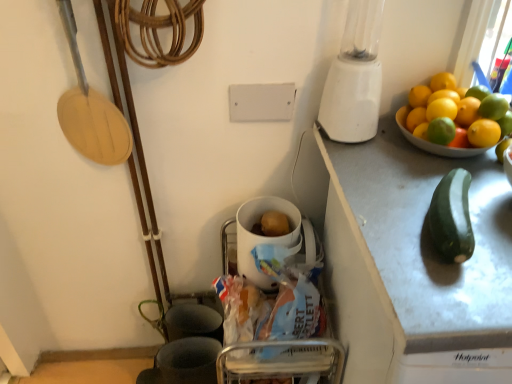
You are a GUI agent. You are given a task and a screenshot of the screen. Output one action in this format:
    pyautogui.click(x=<x>, y=<y>)
    Task: Click on the vacant space to the left of green matte lemon at upper right, which appears as the 1th lemon when ordered from the bottom
    
    Given the screenshot: What is the action you would take?
    pyautogui.click(x=374, y=164)